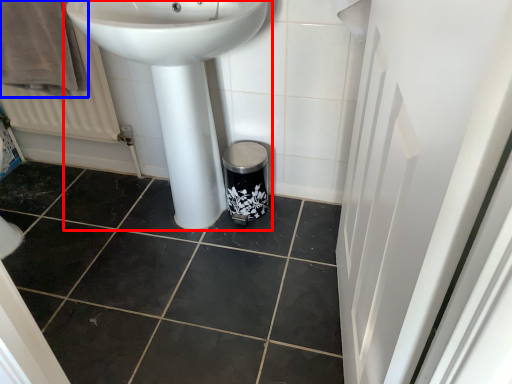
Question: Which of the following is the farthest to the observer, sink (highlighted by a red box) or bath towel (highlighted by a blue box)?

Choices:
 (A) sink
 (B) bath towel

Answer: (B)